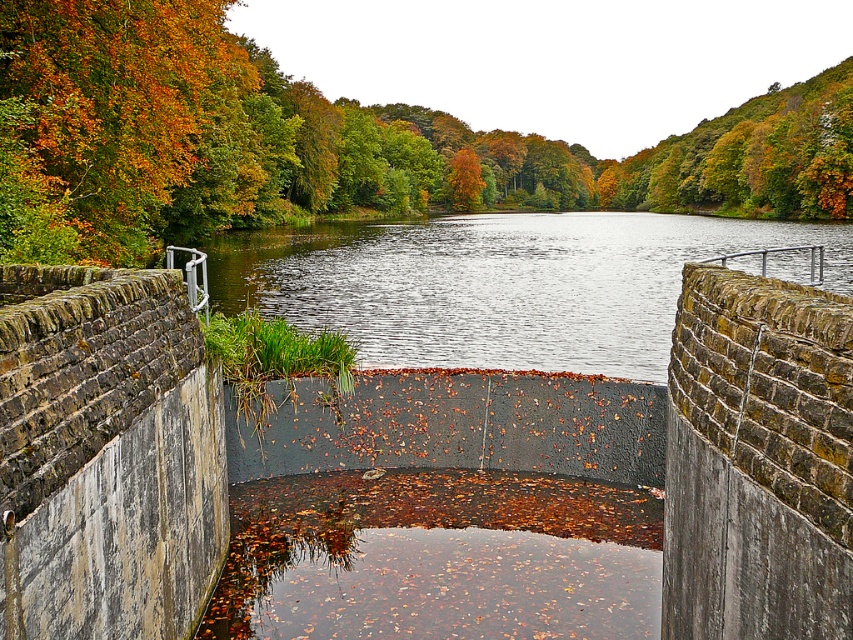
You are standing at the spillway and want to place a small boat exactly at the location of autumn leaves at upper center. What are the coordinates where you should place the boat?

The autumn leaves at upper center are located at coordinates point (308, 141), so you should place the boat there.

You are an environmental scientist assessing the spillway area. You notice autumn leaves at upper center and smooth concrete river at center. Which object takes up more space in the image?

The autumn leaves at upper center has a larger size compared to the smooth concrete river at center, so the autumn leaves at upper center takes up more space in the image.